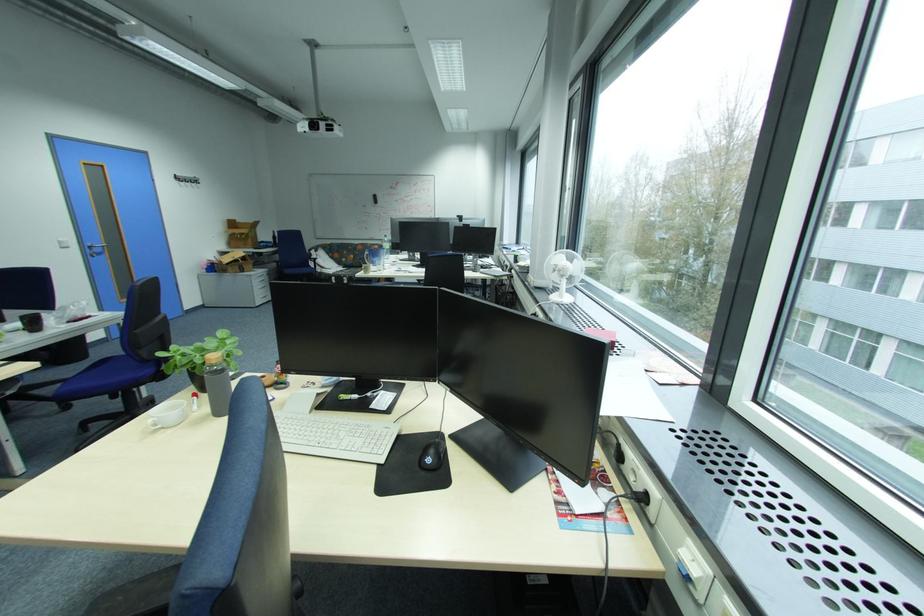
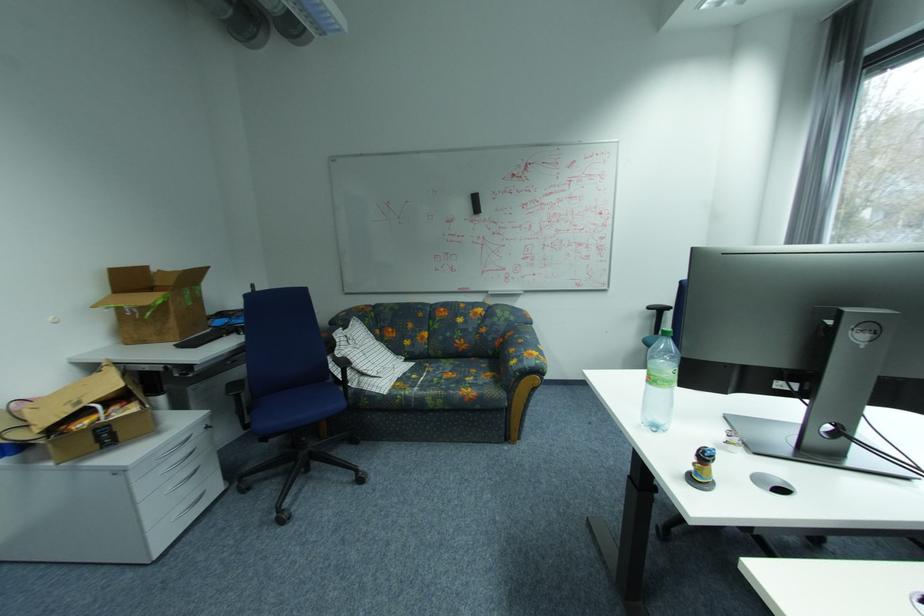
In the second image, find the point that corresponds to (259,243) in the first image.

(180, 323)